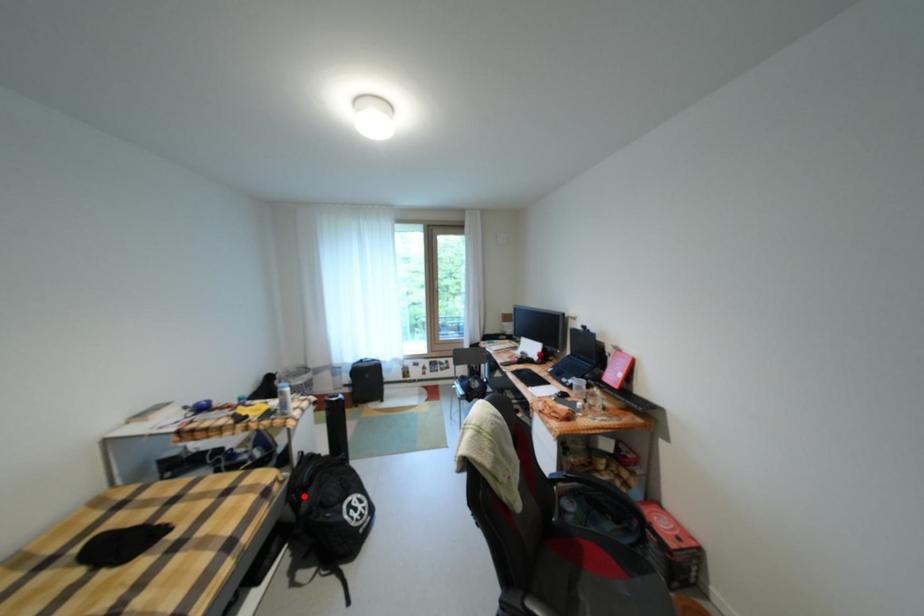
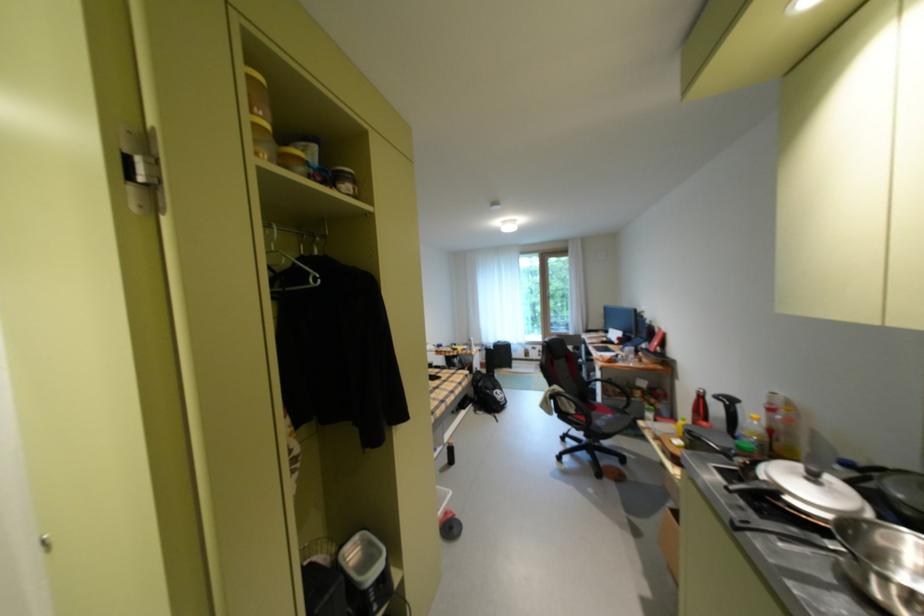
Question: I am providing you with two images of the same scene from different viewpoints. In image1, a red point is highlighted. Considering the same 3D point in image2, which of the following is correct?

Choices:
 (A) It is closer
 (B) It is farther

Answer: (B)